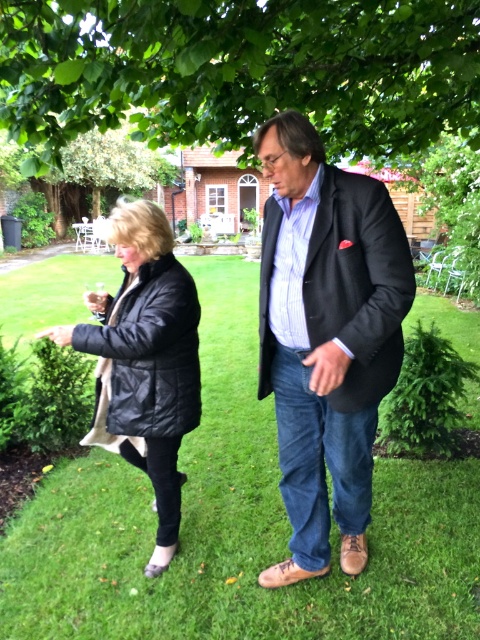
You are standing in the garden scene described. You see a point labeled at coordinates (x=240, y=70). What does this point indicate?

The point at coordinates (x=240, y=70) indicates the location of the green leafy tree at upper center.

You are a fashion designer observing two people in a garden. You need to decide which outfit to recommend based on their height. The matte black blazer at center and the black quilted jacket at left are both options. According to the scene, which jacket appears taller on its wearer?

The matte black blazer at center appears taller than the black quilted jacket at left, so the matte black blazer at center would be the better recommendation for someone wanting a taller appearance.

You are standing in the garden and see both the matte black blazer at center and the black quilted jacket at left. Which one is positioned to the right of the other?

The matte black blazer at center is positioned to the right of the black quilted jacket at left.